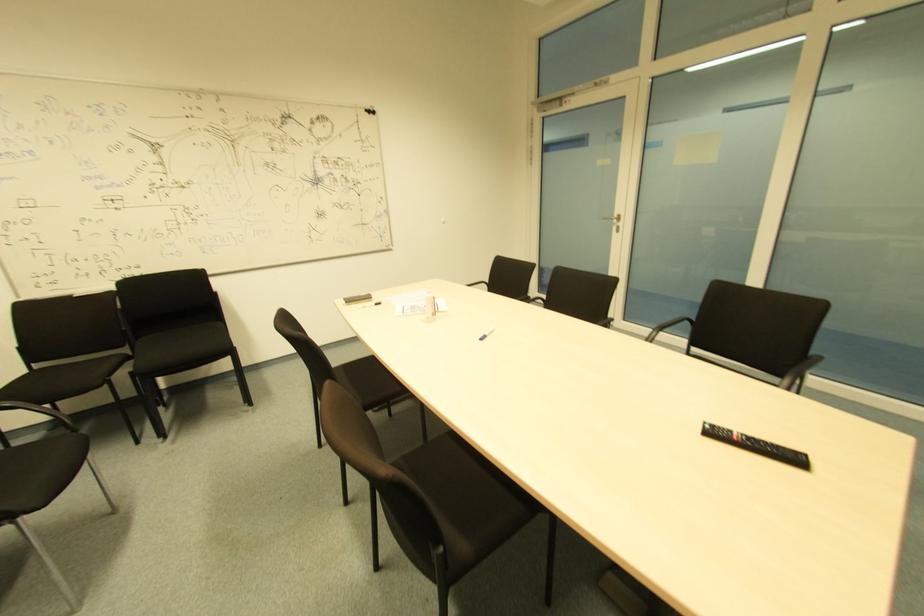
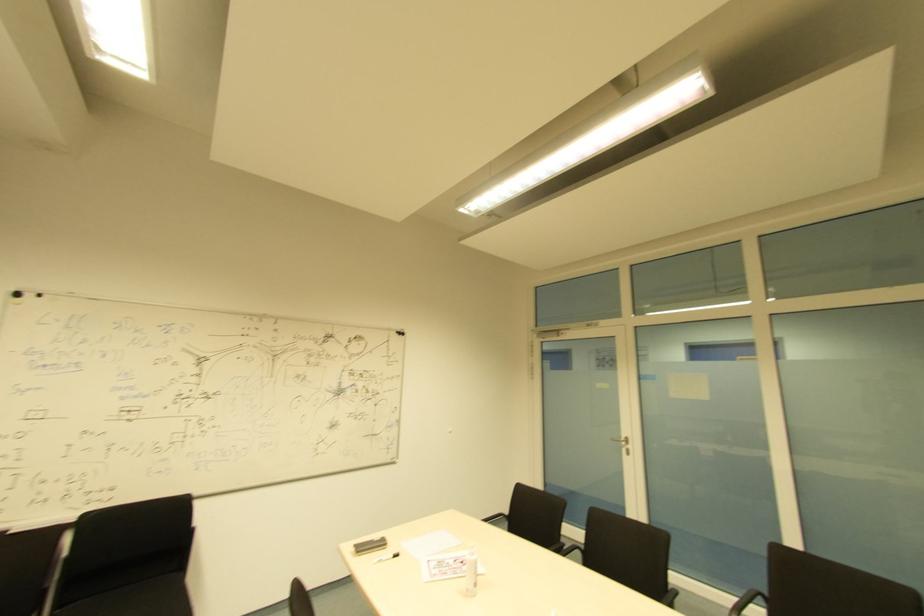
Where in the second image is the point corresponding to (x=374, y=304) from the first image?

(394, 554)